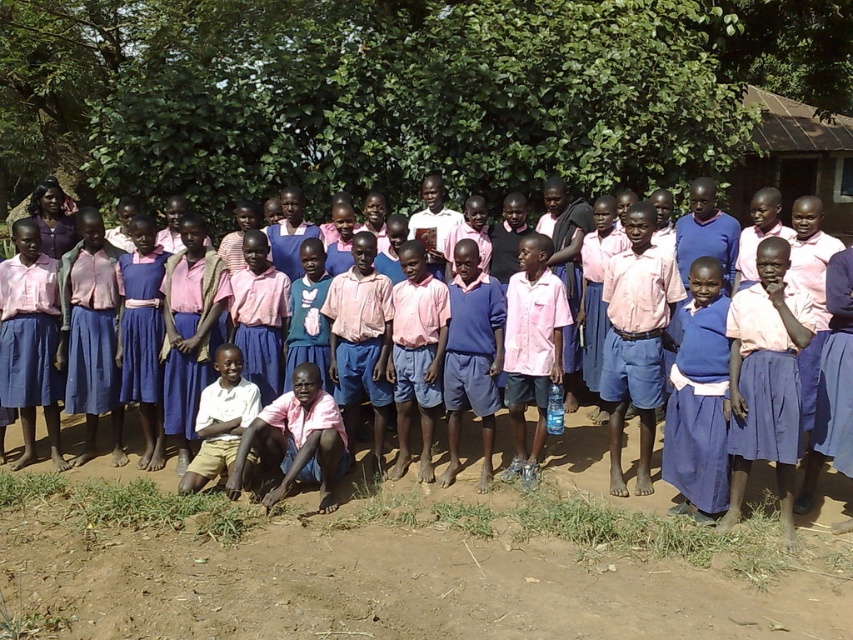
Question: Does brown soil at lower center lie in front of pink fabric shirt at center?

Choices:
 (A) yes
 (B) no

Answer: (A)

Question: Is brown soil at lower center bigger than pink fabric shirt at center?

Choices:
 (A) yes
 (B) no

Answer: (A)

Question: Which object is farther from the camera taking this photo?

Choices:
 (A) pink fabric shirt at center
 (B) brown soil at lower center

Answer: (A)

Question: Does brown soil at lower center appear under pink fabric shirt at center?

Choices:
 (A) yes
 (B) no

Answer: (A)